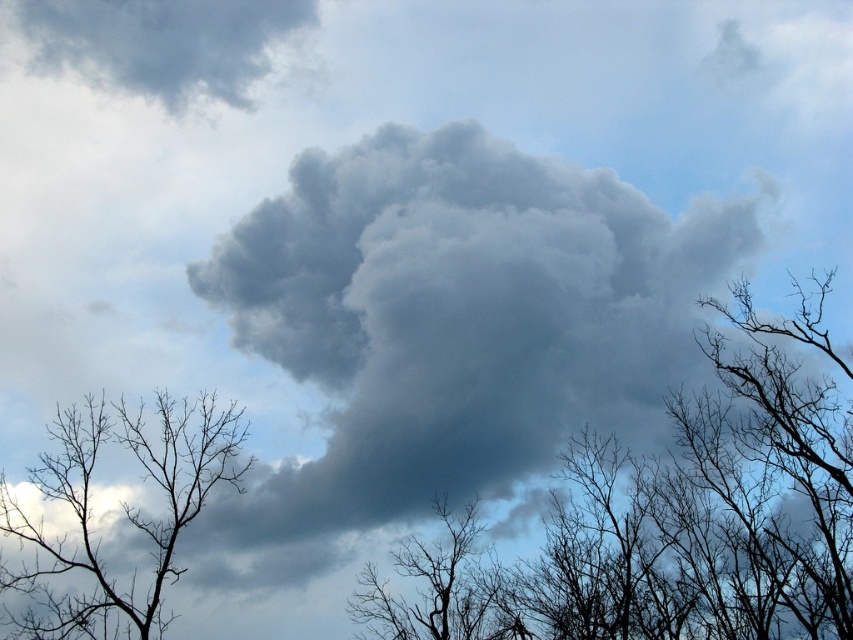
Between gray fluffy cloud at upper left and silhouette bare tree at center, which one is positioned lower?

Positioned lower is silhouette bare tree at center.

Which is behind, point (199, 61) or point (376, 628)?

Point (376, 628)

Which is in front, point (28, 1) or point (454, 547)?

Point (28, 1) is more forward.

At what (x,y) coordinates should I click in order to perform the action: click on gray fluffy cloud at upper left. Please return your answer as a coordinate pair (x, y). The height and width of the screenshot is (640, 853). Looking at the image, I should click on (161, 42).

Is silhouette bare branches at left below silhouette bare tree at center?

No, silhouette bare branches at left is not below silhouette bare tree at center.

Between point (186, 513) and point (434, 592), which one is positioned in front?

Positioned in front is point (186, 513).

You are a GUI agent. You are given a task and a screenshot of the screen. Output one action in this format:
    pyautogui.click(x=<x>, y=<y>)
    Task: Click on the silhouette bare branches at left
    
    Given the screenshot: What is the action you would take?
    pyautogui.click(x=120, y=509)

The height and width of the screenshot is (640, 853). I want to click on silhouette bare branches at left, so click(120, 509).

Which of these two, silhouette bare branches at center or gray fluffy cloud at upper left, stands taller?

silhouette bare branches at center

Is point (840, 566) positioned behind point (299, 4)?

No.

Find the location of a particular element. silhouette bare branches at center is located at coordinates (670, 518).